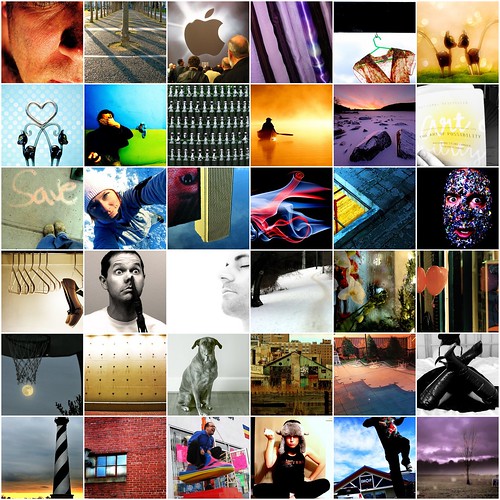
At what (x,y) coordinates should I click in order to perform the action: click on pictures in 3rd row from top. Please return your answer as a coordinate pair (x, y). The height and width of the screenshot is (500, 500). Looking at the image, I should click on (51, 217), (117, 205), (196, 210), (298, 222), (364, 213), (461, 210).